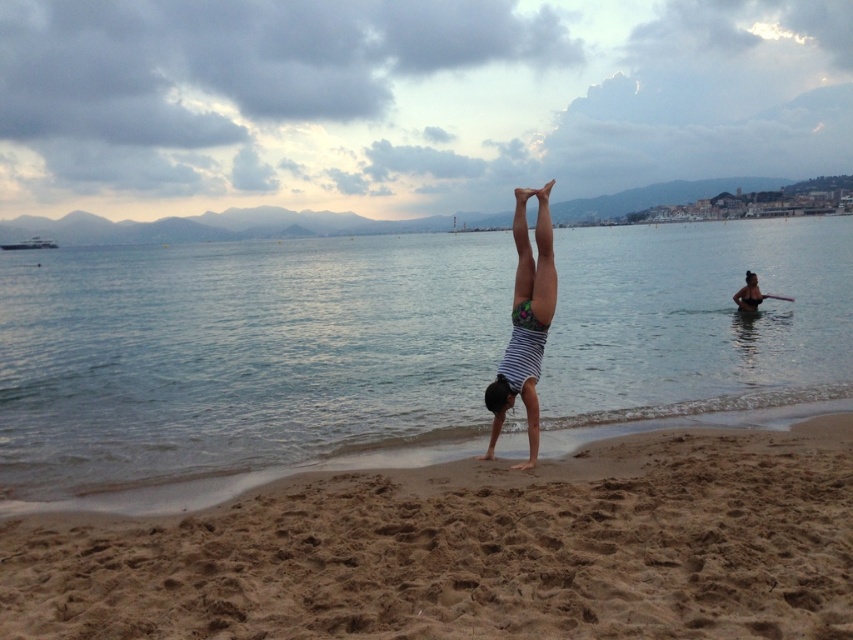
You are a photographer trying to capture the handstand performer. You need to position yourself so that the clear blue water at center and the brown sandy beach at center are both visible in the frame. Which object should you place closer to the bottom of your camera viewfinder to ensure both are included?

To include both the clear blue water at center and the brown sandy beach at center in the frame, position the brown sandy beach at center closer to the bottom of the viewfinder since the clear blue water at center is located above it.

You are a lifeguard standing at the point marked by the coordinates point (242, 358). You notice a swimmer in trouble 10 meters away from your position. Can you reach them before the incoming tide covers the area? The tide rises at a rate of 0.5 meters per minute.

A: The point marked by the coordinates point (242, 358) is clear blue water at center. Since the swimmer is 10 meters away and the tide rises at 0.5 meters per minute, it would take 20 minutes for the tide to cover the area. A lifeguard can likely reach the swimmer in under 20 minutes, so yes, the lifeguard can reach them before the tide covers the area.

You are standing on the beach and want to take a photo of the striped fabric person at center and the clear blue water at center. Which object should you focus on first if you want both to be in sharp focus?

The clear blue water at center is closer to the viewer than the striped fabric person at center. To have both in sharp focus, focus on the striped fabric person at center since it is farther away, as depth of field typically extends further behind the point of focus than in front.